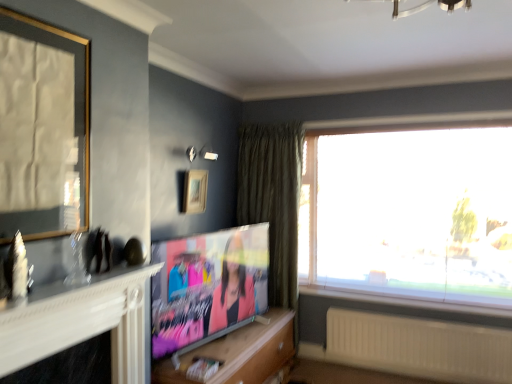
You are a GUI agent. You are given a task and a screenshot of the screen. Output one action in this format:
    pyautogui.click(x=<x>, y=<y>)
    Task: Click on the free spot to the left of matte paper magazine at lower center
    This screenshot has height=384, width=512.
    Given the screenshot: What is the action you would take?
    pyautogui.click(x=170, y=370)